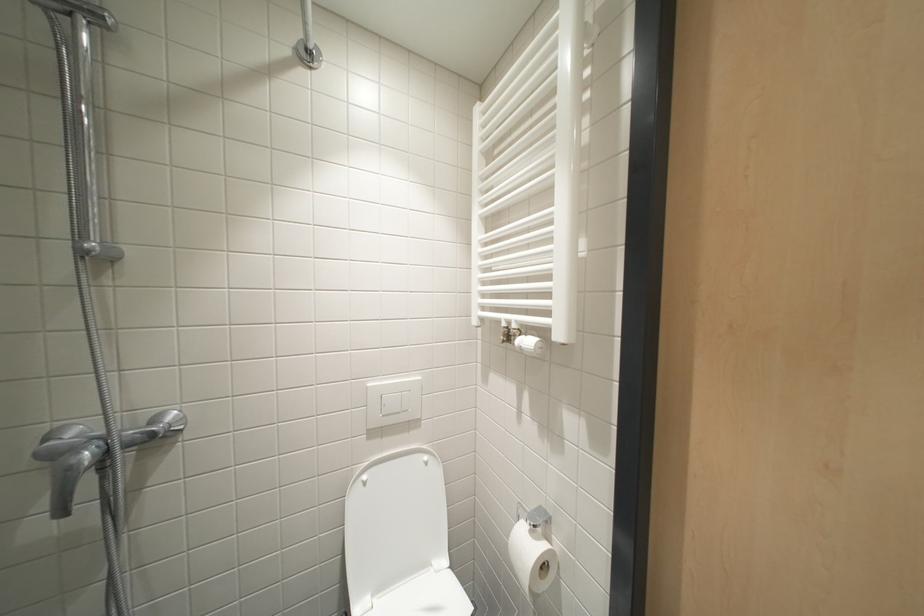
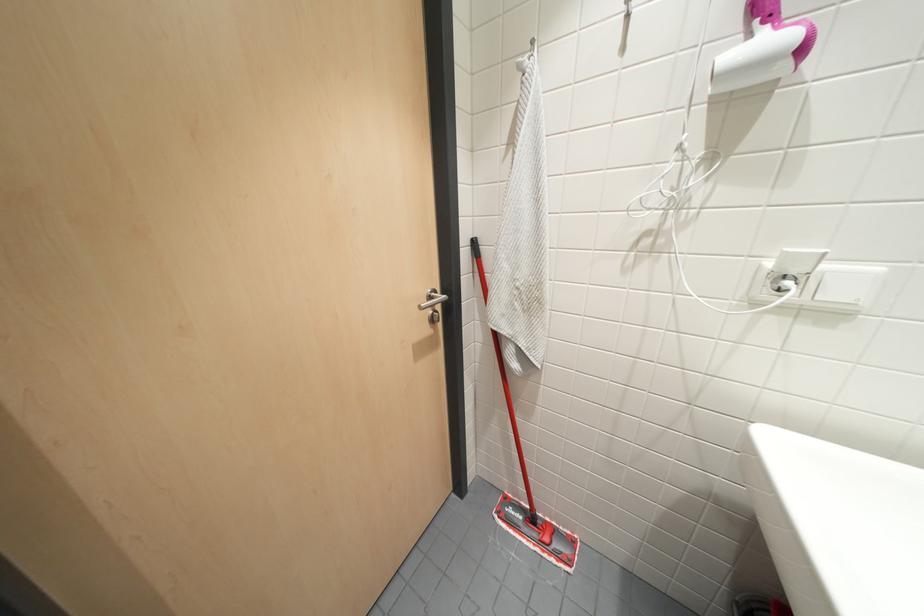
Based on the continuous images, in which direction is the camera rotating?

The rotation direction of the camera is right-down.